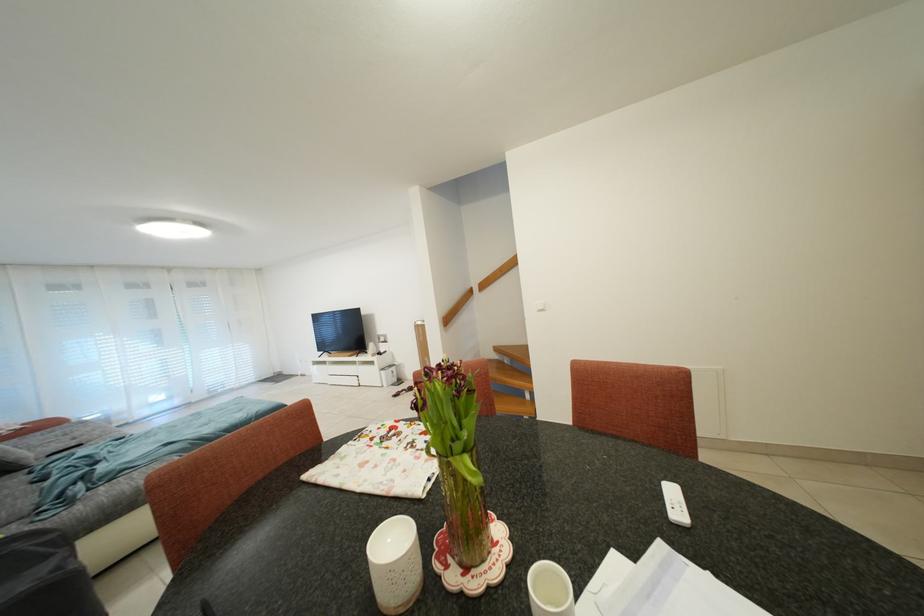
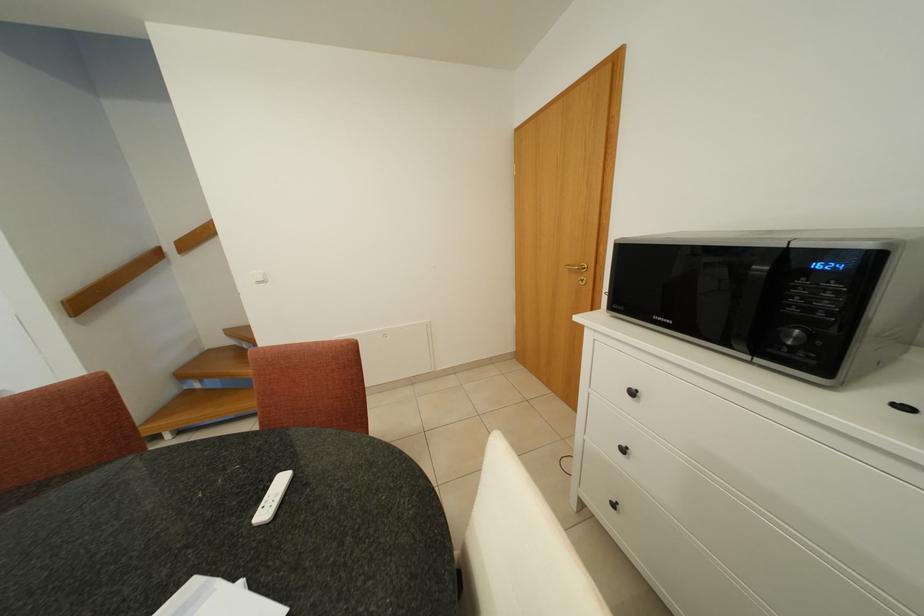
Question: The images are taken continuously from a first-person perspective. In which direction is your viewpoint rotating?

Choices:
 (A) Left
 (B) Right
 (C) Up
 (D) Down

Answer: (B)